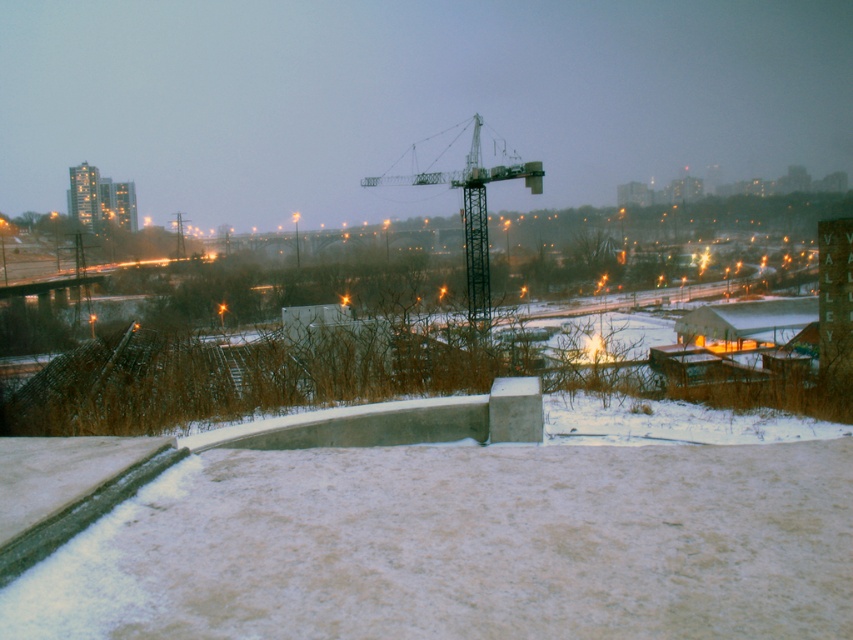
You are a construction worker who needs to place a new equipment container that is 2 meters in length. You see the white powdery snow at lower center and the metallic gray crane at center. Which area has enough space to accommodate the container?

The metallic gray crane at center occupies more space than the white powdery snow at lower center, so the metallic gray crane at center has enough space to accommodate the container.

Consider the image. You are a delivery person trying to navigate through the snow to reach the construction site. There is white powdery snow at lower center and a metallic gray crane at center. Which direction should you head to reach the crane from the snow?

To reach the metallic gray crane at center from the white powdery snow at lower center, you should head to the right since the snow is located to the left of the crane.

You are a construction worker who needs to place a heavy equipment box on the ground. You see the white powdery snow at lower center and the metallic gray crane at center. Which location is more suitable for placing the box to ensure stability?

The metallic gray crane at center is more suitable for placing the heavy equipment box because the white powdery snow at lower center is located below it, which might not provide a stable base.